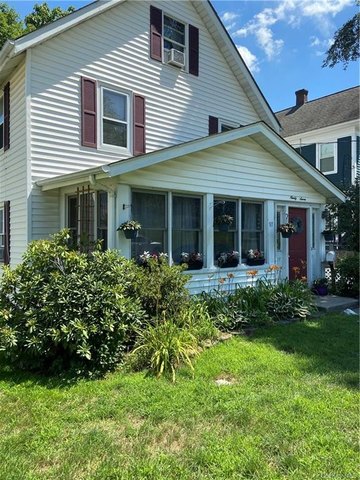
At what (x,y) coordinates should I click in order to perform the action: click on door. Please return your answer as a coordinate pair (x, y). The height and width of the screenshot is (480, 360). Looking at the image, I should click on (301, 248).